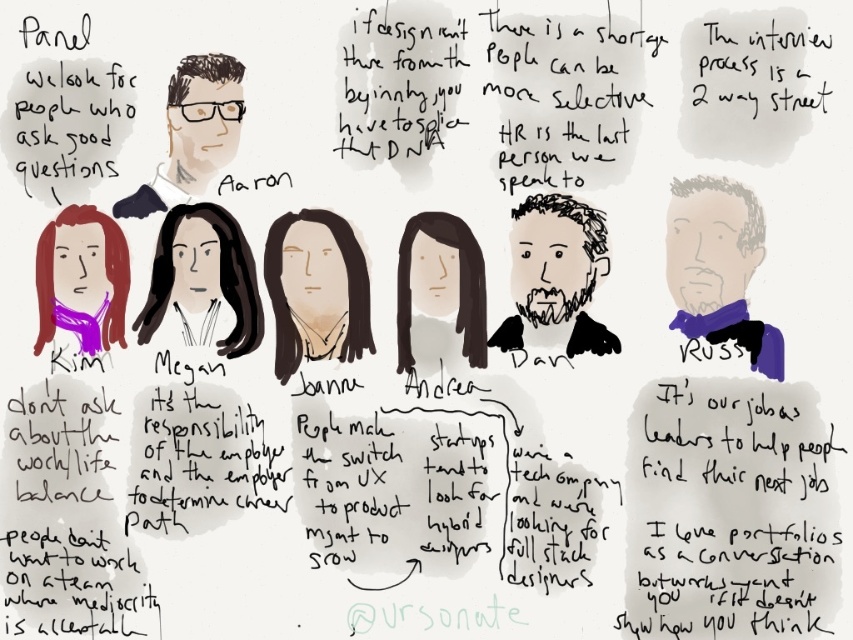
Which is behind, point (223, 124) or point (469, 244)?

Point (469, 244)

Who is positioned more to the right, matte black glasses at upper center or brown matte hair at center?

From the viewer's perspective, brown matte hair at center appears more on the right side.

You are a GUI agent. You are given a task and a screenshot of the screen. Output one action in this format:
    pyautogui.click(x=<x>, y=<y>)
    Task: Click on the matte black glasses at upper center
    Image resolution: width=853 pixels, height=640 pixels.
    Given the screenshot: What is the action you would take?
    pyautogui.click(x=193, y=132)

Is white paper at lower right thinner than matte black glasses at upper center?

In fact, white paper at lower right might be wider than matte black glasses at upper center.

Does point (706, 426) lie in front of point (189, 173)?

Yes, point (706, 426) is closer to viewer.

In order to click on white paper at lower right in this screenshot , I will do `click(729, 512)`.

Looking at this image, who is shorter, purple fabric shirt at right or brown matte hair at center?

With less height is brown matte hair at center.

The image size is (853, 640). In order to click on purple fabric shirt at right in this screenshot , I will do `click(718, 266)`.